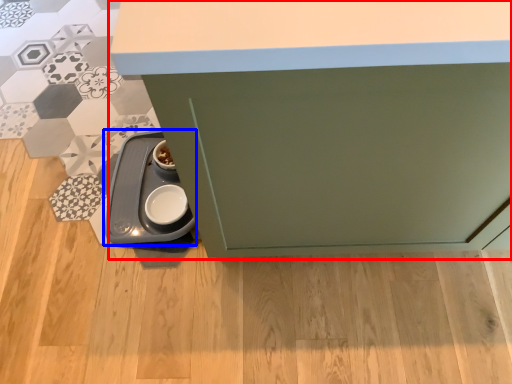
Question: Which object is further to the camera taking this photo, cabinetry (highlighted by a red box) or appliance (highlighted by a blue box)?

Choices:
 (A) cabinetry
 (B) appliance

Answer: (B)